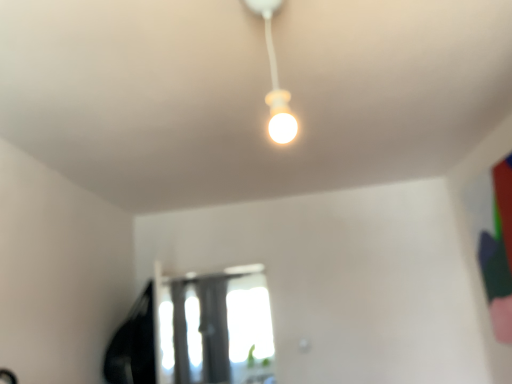
Question: Should I look upward or downward to see matte white bulb at center?

Choices:
 (A) up
 (B) down

Answer: (A)

Question: Is matte white bulb at center next to transparent glass window at center and touching it?

Choices:
 (A) yes
 (B) no

Answer: (B)

Question: Is matte white bulb at center shorter than transparent glass window at center?

Choices:
 (A) no
 (B) yes

Answer: (B)

Question: From a real-world perspective, is matte white bulb at center located beneath transparent glass window at center?

Choices:
 (A) no
 (B) yes

Answer: (A)

Question: Can you confirm if matte white bulb at center is thinner than transparent glass window at center?

Choices:
 (A) yes
 (B) no

Answer: (B)

Question: From the image's perspective, is matte white bulb at center beneath transparent glass window at center?

Choices:
 (A) no
 (B) yes

Answer: (A)

Question: Is matte white bulb at center surrounding transparent glass window at center?

Choices:
 (A) no
 (B) yes

Answer: (A)

Question: Is transparent glass window at center oriented towards matte white bulb at center?

Choices:
 (A) yes
 (B) no

Answer: (A)

Question: From the image's perspective, is transparent glass window at center on top of matte white bulb at center?

Choices:
 (A) no
 (B) yes

Answer: (A)

Question: Is transparent glass window at center positioned beyond the bounds of matte white bulb at center?

Choices:
 (A) yes
 (B) no

Answer: (A)

Question: Is transparent glass window at center turned away from matte white bulb at center?

Choices:
 (A) no
 (B) yes

Answer: (A)

Question: From the image's perspective, would you say transparent glass window at center is shown under matte white bulb at center?

Choices:
 (A) no
 (B) yes

Answer: (B)

Question: Is transparent glass window at center at the right side of matte white bulb at center?

Choices:
 (A) yes
 (B) no

Answer: (B)

Question: From a real-world perspective, is transparent glass window at center positioned above or below matte white bulb at center?

Choices:
 (A) above
 (B) below

Answer: (B)